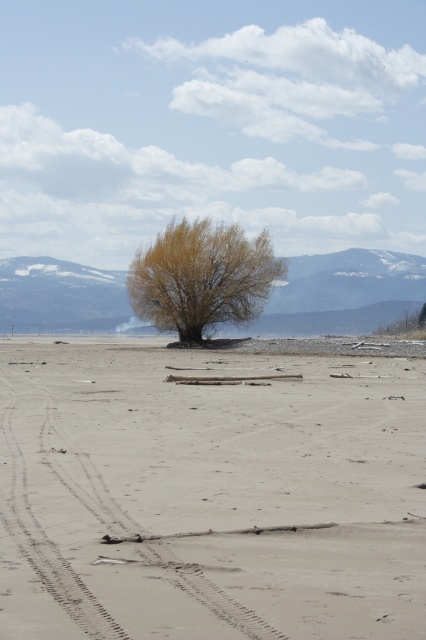
You are standing on the beach and want to walk towards the two points marked in the image. Which point, point (78, 388) or point (242, 308), will you reach first?

You will reach point (78, 388) first because it is closer to you than point (242, 308).